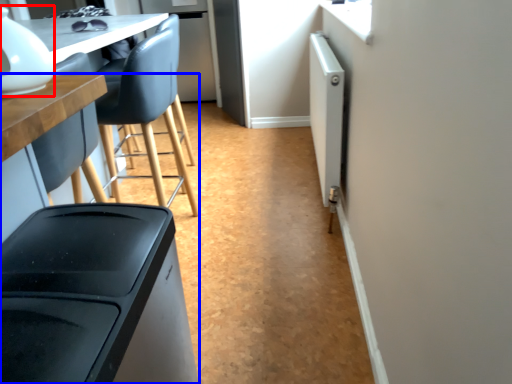
Question: Which point is closer to the camera, appliance (highlighted by a red box) or table (highlighted by a blue box)?

Choices:
 (A) appliance
 (B) table

Answer: (B)